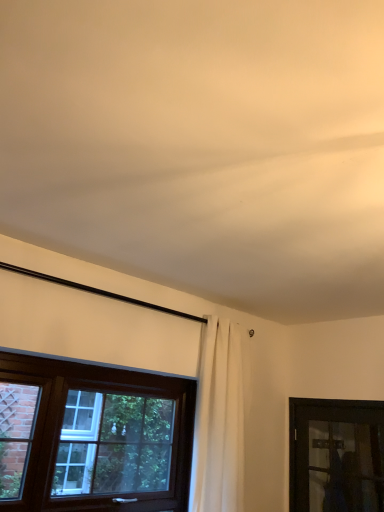
Image resolution: width=384 pixels, height=512 pixels. Describe the element at coordinates (92, 437) in the screenshot. I see `brown wooden window at lower left, which appears as the 1th window when viewed from the left` at that location.

I want to click on brown wooden window at lower left, which appears as the 2th window when viewed from the right, so pyautogui.click(x=92, y=437).

Considering the points (236, 472) and (28, 355), which point is in front, point (236, 472) or point (28, 355)?

The point (28, 355) is closer.

Would you say white fabric curtain at center is a long distance from brown wooden window at lower left, which appears as the 1th window when viewed from the left?

No, white fabric curtain at center is not far away from brown wooden window at lower left, which appears as the 1th window when viewed from the left.

Which object is further away from the camera taking this photo, white fabric curtain at center or brown wooden window at lower left, which appears as the 2th window when viewed from the right?

white fabric curtain at center is more distant.

Considering the positions of objects white fabric curtain at center and brown wooden window at lower left, which appears as the 1th window when viewed from the left, in the image provided, who is more to the left, white fabric curtain at center or brown wooden window at lower left, which appears as the 1th window when viewed from the left,?

Positioned to the left is brown wooden window at lower left, which appears as the 1th window when viewed from the left.

From the image's perspective, is brown wooden window at lower left, which appears as the 1th window when viewed from the left, located beneath white fabric curtain at center?

Yes, from the image's perspective, brown wooden window at lower left, which appears as the 1th window when viewed from the left, is below white fabric curtain at center.

Considering the sizes of objects brown wooden window at lower left, which appears as the 2th window when viewed from the right, and white fabric curtain at center in the image provided, who is smaller, brown wooden window at lower left, which appears as the 2th window when viewed from the right, or white fabric curtain at center?

brown wooden window at lower left, which appears as the 2th window when viewed from the right.

Is brown wooden window at lower left, which appears as the 2th window when viewed from the right, taller than white fabric curtain at center?

No.

From the picture: From a real-world perspective, is brown wooden window at lower left, which appears as the 1th window when viewed from the left, below white fabric curtain at center?

Indeed, from a real-world perspective, brown wooden window at lower left, which appears as the 1th window when viewed from the left, is positioned beneath white fabric curtain at center.

Which object is wider, transparent glass door at lower right, marked as the 1th window in a right-to-left arrangement, or brown wooden window at lower left, which appears as the 1th window when viewed from the left?

brown wooden window at lower left, which appears as the 1th window when viewed from the left, is wider.

Considering the points (350, 457) and (52, 497), which point is behind, point (350, 457) or point (52, 497)?

Positioned behind is point (350, 457).

Considering the relative sizes of transparent glass door at lower right, marked as the 1th window in a right-to-left arrangement, and brown wooden window at lower left, which appears as the 1th window when viewed from the left, in the image provided, is transparent glass door at lower right, marked as the 1th window in a right-to-left arrangement, taller than brown wooden window at lower left, which appears as the 1th window when viewed from the left,?

In fact, transparent glass door at lower right, marked as the 1th window in a right-to-left arrangement, may be shorter than brown wooden window at lower left, which appears as the 1th window when viewed from the left.

Which of these two, transparent glass door at lower right, marked as the 1th window in a right-to-left arrangement, or brown wooden window at lower left, which appears as the 2th window when viewed from the right, is bigger?

With larger size is brown wooden window at lower left, which appears as the 2th window when viewed from the right.

Considering the sizes of objects transparent glass door at lower right, which ranks as the second window in left-to-right order, and white fabric curtain at center in the image provided, who is wider, transparent glass door at lower right, which ranks as the second window in left-to-right order, or white fabric curtain at center?

Wider between the two is white fabric curtain at center.

Which object is positioned more to the right, transparent glass door at lower right, which ranks as the second window in left-to-right order, or white fabric curtain at center?

transparent glass door at lower right, which ranks as the second window in left-to-right order, is more to the right.

From a real-world perspective, is transparent glass door at lower right, which ranks as the second window in left-to-right order, physically located above or below white fabric curtain at center?

transparent glass door at lower right, which ranks as the second window in left-to-right order, is below white fabric curtain at center.

Is brown wooden window at lower left, which appears as the 2th window when viewed from the right, facing towards transparent glass door at lower right, which ranks as the second window in left-to-right order?

No, brown wooden window at lower left, which appears as the 2th window when viewed from the right, is not aimed at transparent glass door at lower right, which ranks as the second window in left-to-right order.

From the image's perspective, is brown wooden window at lower left, which appears as the 1th window when viewed from the left, positioned above or below transparent glass door at lower right, marked as the 1th window in a right-to-left arrangement?

brown wooden window at lower left, which appears as the 1th window when viewed from the left, is above transparent glass door at lower right, marked as the 1th window in a right-to-left arrangement.

Is point (105, 473) positioned after point (378, 508)?

No.

Which is more distant, (213, 408) or (324, 465)?

Positioned behind is point (324, 465).

The image size is (384, 512). Identify the location of curtain in front of the transparent glass door at lower right, which ranks as the second window in left-to-right order. (219, 421).

From the picture: Considering the sizes of white fabric curtain at center and transparent glass door at lower right, which ranks as the second window in left-to-right order, in the image, is white fabric curtain at center bigger or smaller than transparent glass door at lower right, which ranks as the second window in left-to-right order,?

Considering their sizes, white fabric curtain at center takes up more space than transparent glass door at lower right, which ranks as the second window in left-to-right order.

Locate an element on the screen. The image size is (384, 512). curtain behind the brown wooden window at lower left, which appears as the 1th window when viewed from the left is located at coordinates (219, 421).

Locate an element on the screen. This screenshot has width=384, height=512. curtain that is above the brown wooden window at lower left, which appears as the 1th window when viewed from the left (from a real-world perspective) is located at coordinates (219, 421).

Based on their spatial positions, is white fabric curtain at center or transparent glass door at lower right, marked as the 1th window in a right-to-left arrangement, further from brown wooden window at lower left, which appears as the 1th window when viewed from the left?

transparent glass door at lower right, marked as the 1th window in a right-to-left arrangement, is positioned further to the anchor brown wooden window at lower left, which appears as the 1th window when viewed from the left.

From the image, which object appears to be farther from white fabric curtain at center, brown wooden window at lower left, which appears as the 1th window when viewed from the left, or transparent glass door at lower right, which ranks as the second window in left-to-right order?

transparent glass door at lower right, which ranks as the second window in left-to-right order.

Looking at the image, which one is located closer to brown wooden window at lower left, which appears as the 2th window when viewed from the right, transparent glass door at lower right, marked as the 1th window in a right-to-left arrangement, or white fabric curtain at center?

Based on the image, white fabric curtain at center appears to be nearer to brown wooden window at lower left, which appears as the 2th window when viewed from the right.

Based on their spatial positions, is white fabric curtain at center or brown wooden window at lower left, which appears as the 2th window when viewed from the right, closer to transparent glass door at lower right, which ranks as the second window in left-to-right order?

white fabric curtain at center lies closer to transparent glass door at lower right, which ranks as the second window in left-to-right order, than the other object.

When comparing their distances from white fabric curtain at center, does transparent glass door at lower right, marked as the 1th window in a right-to-left arrangement, or brown wooden window at lower left, which appears as the 1th window when viewed from the left, seem further?

The object further to white fabric curtain at center is transparent glass door at lower right, marked as the 1th window in a right-to-left arrangement.

Estimate the real-world distances between objects in this image. Which object is further from transparent glass door at lower right, marked as the 1th window in a right-to-left arrangement, brown wooden window at lower left, which appears as the 1th window when viewed from the left, or white fabric curtain at center?

Based on the image, brown wooden window at lower left, which appears as the 1th window when viewed from the left, appears to be further to transparent glass door at lower right, marked as the 1th window in a right-to-left arrangement.

The image size is (384, 512). I want to click on curtain between brown wooden window at lower left, which appears as the 2th window when viewed from the right, and transparent glass door at lower right, marked as the 1th window in a right-to-left arrangement, from left to right, so click(219, 421).